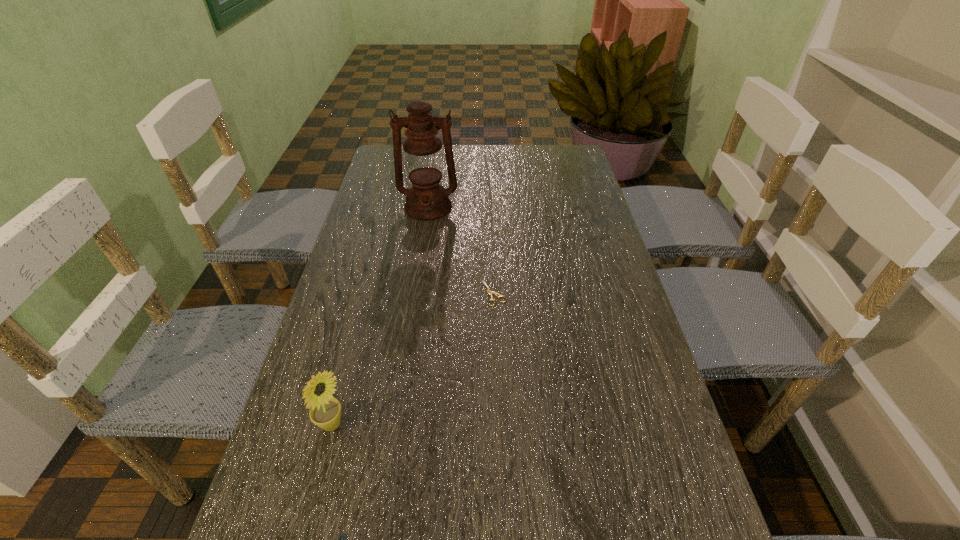
At what (x,y) coordinates should I click in order to perform the action: click on sunflower located in the left edge section of the desktop. Please return your answer as a coordinate pair (x, y). The width and height of the screenshot is (960, 540). Looking at the image, I should click on (325, 412).

In the image, there is a desktop. What are the coordinates of `free space at the far edge` in the screenshot? It's located at (467, 154).

In the image, there is a desktop. Identify the location of vacant space at the left edge. The height and width of the screenshot is (540, 960). (369, 217).

The height and width of the screenshot is (540, 960). Identify the location of vacant space at the right edge of the desktop. pyautogui.click(x=588, y=273).

This screenshot has height=540, width=960. Identify the location of blank area at the far right corner. (558, 147).

Identify the location of free space that is in between the right shears and the farthest object. (461, 250).

The height and width of the screenshot is (540, 960). Identify the location of free space between the tallest object and the second tallest object. click(380, 316).

This screenshot has height=540, width=960. I want to click on empty space between the taller shears and the farthest object, so click(461, 250).

This screenshot has height=540, width=960. I want to click on vacant point located between the tallest object and the farther shears, so click(x=461, y=250).

Locate which object is the third closest to the farther shears. Please provide its 2D coordinates. Your answer should be formatted as a tuple, i.e. [(x, y)], where the tuple contains the x and y coordinates of a point satisfying the conditions above.

[(344, 535)]